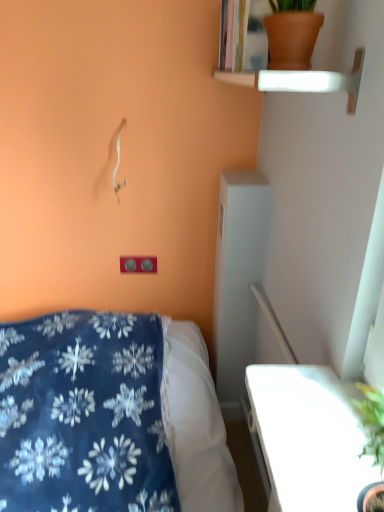
Question: Does terracotta clay pot at upper right lie in front of matte plastic outlet at lower center?

Choices:
 (A) no
 (B) yes

Answer: (B)

Question: From the image's perspective, does terracotta clay pot at upper right appear higher than matte plastic outlet at lower center?

Choices:
 (A) yes
 (B) no

Answer: (A)

Question: Is matte plastic outlet at lower center surrounded by terracotta clay pot at upper right?

Choices:
 (A) no
 (B) yes

Answer: (A)

Question: Is terracotta clay pot at upper right at the right side of matte plastic outlet at lower center?

Choices:
 (A) no
 (B) yes

Answer: (B)

Question: Does terracotta clay pot at upper right have a greater height compared to matte plastic outlet at lower center?

Choices:
 (A) no
 (B) yes

Answer: (B)

Question: Considering the relative positions of terracotta clay pot at upper right and matte plastic outlet at lower center in the image provided, is terracotta clay pot at upper right to the left of matte plastic outlet at lower center from the viewer's perspective?

Choices:
 (A) no
 (B) yes

Answer: (A)

Question: Can you confirm if matte plastic outlet at lower center is taller than terracotta clay pot at upper right?

Choices:
 (A) yes
 (B) no

Answer: (B)

Question: Is matte plastic outlet at lower center positioned beyond the bounds of terracotta clay pot at upper right?

Choices:
 (A) no
 (B) yes

Answer: (B)

Question: Does matte plastic outlet at lower center turn towards terracotta clay pot at upper right?

Choices:
 (A) no
 (B) yes

Answer: (A)

Question: Is matte plastic outlet at lower center directly adjacent to terracotta clay pot at upper right?

Choices:
 (A) yes
 (B) no

Answer: (B)

Question: Considering the relative positions of matte plastic outlet at lower center and terracotta clay pot at upper right in the image provided, is matte plastic outlet at lower center to the right of terracotta clay pot at upper right from the viewer's perspective?

Choices:
 (A) yes
 (B) no

Answer: (B)

Question: Does matte plastic outlet at lower center have a larger size compared to terracotta clay pot at upper right?

Choices:
 (A) no
 (B) yes

Answer: (A)

Question: Considering the positions of terracotta clay pot at upper right and matte plastic outlet at lower center in the image, is terracotta clay pot at upper right wider or thinner than matte plastic outlet at lower center?

Choices:
 (A) thin
 (B) wide

Answer: (B)